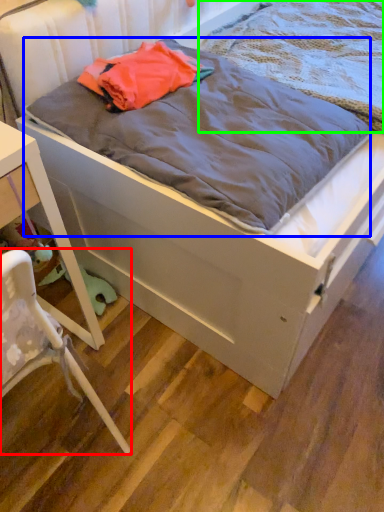
Question: Which object is positioned closest to chair (highlighted by a red box)? Select from blanket (highlighted by a blue box) and blanket (highlighted by a green box).

Choices:
 (A) blanket
 (B) blanket

Answer: (A)